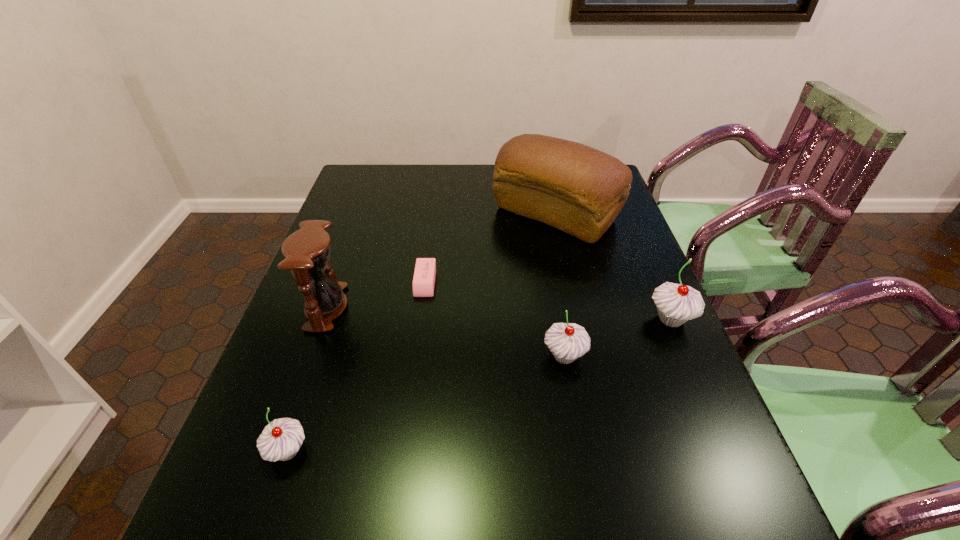
If the aim is uniform spacing by inserting an additional cupcake among them, please point to a vacant space for this new cupcake. Please provide its 2D coordinates. Your answer should be formatted as a tuple, i.e. [(x, y)], where the tuple contains the x and y coordinates of a point satisfying the conditions above.

[(439, 399)]